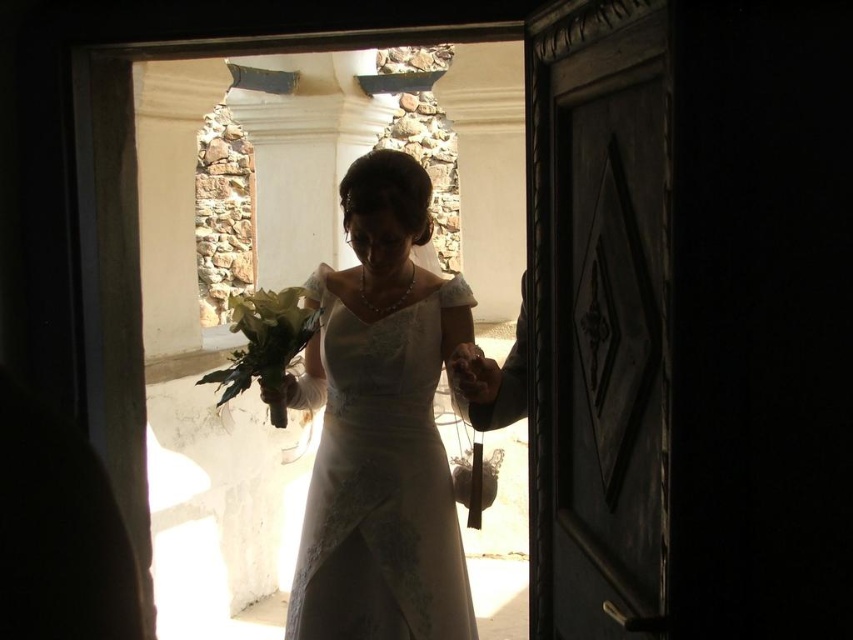
Question: Which point appears farthest from the camera in this image?

Choices:
 (A) (426, 406)
 (B) (309, 323)

Answer: (A)

Question: From the image, what is the correct spatial relationship of white satin dress at center in relation to green leafy bouquet at center?

Choices:
 (A) right
 (B) left

Answer: (A)

Question: Which point is closer to the camera taking this photo?

Choices:
 (A) (303, 296)
 (B) (335, 424)

Answer: (B)

Question: Which point is closer to the camera?

Choices:
 (A) (299, 620)
 (B) (265, 362)

Answer: (A)

Question: Does white satin dress at center appear under green leafy bouquet at center?

Choices:
 (A) yes
 (B) no

Answer: (A)

Question: Can you confirm if white satin dress at center is smaller than green leafy bouquet at center?

Choices:
 (A) no
 (B) yes

Answer: (A)